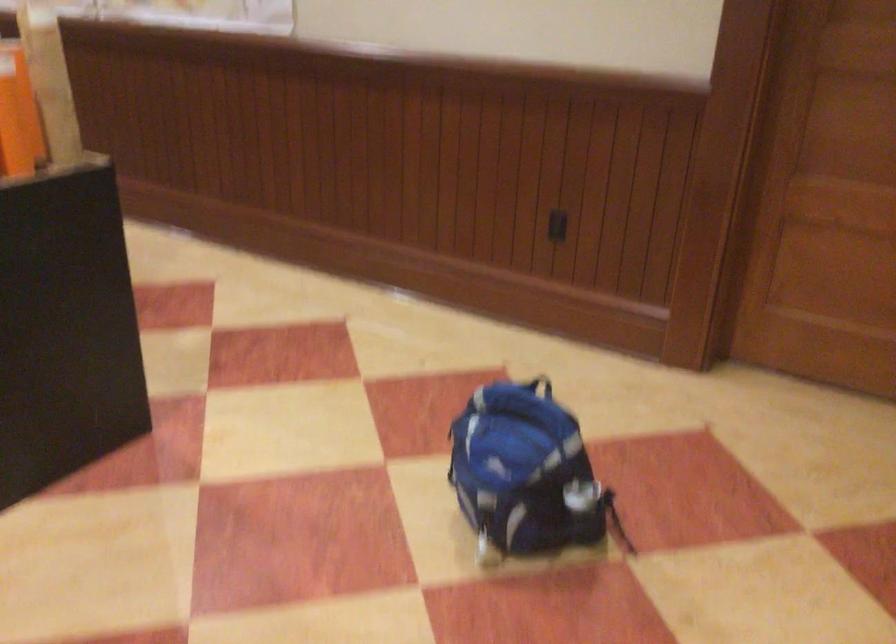
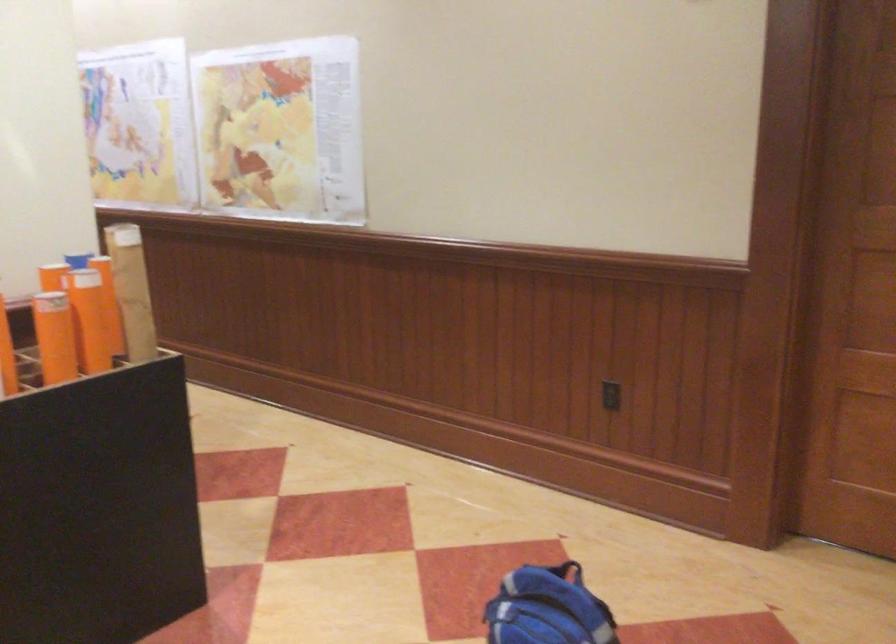
Locate, in the second image, the point that corresponds to the point at 538,386 in the first image.

(567, 571)